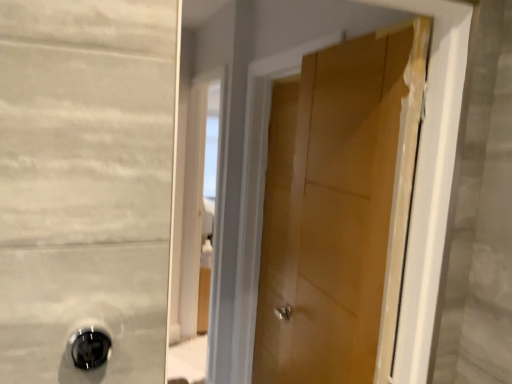
Question: Considering the relative sizes of wooden door at center and black glossy door handle at lower left in the image provided, is wooden door at center shorter than black glossy door handle at lower left?

Choices:
 (A) yes
 (B) no

Answer: (B)

Question: Is wooden door at center bigger than black glossy door handle at lower left?

Choices:
 (A) no
 (B) yes

Answer: (B)

Question: Is wooden door at center positioned behind black glossy door handle at lower left?

Choices:
 (A) no
 (B) yes

Answer: (B)

Question: Is wooden door at center thinner than black glossy door handle at lower left?

Choices:
 (A) yes
 (B) no

Answer: (B)

Question: Can you confirm if wooden door at center is positioned to the right of black glossy door handle at lower left?

Choices:
 (A) no
 (B) yes

Answer: (B)

Question: Does wooden door at center appear on the left side of black glossy door handle at lower left?

Choices:
 (A) no
 (B) yes

Answer: (A)

Question: Considering the relative sizes of black glossy door handle at lower left and wooden door at center in the image provided, is black glossy door handle at lower left shorter than wooden door at center?

Choices:
 (A) yes
 (B) no

Answer: (A)

Question: Can you confirm if black glossy door handle at lower left is positioned to the right of wooden door at center?

Choices:
 (A) no
 (B) yes

Answer: (A)

Question: Is black glossy door handle at lower left closer to the viewer compared to wooden door at center?

Choices:
 (A) no
 (B) yes

Answer: (B)

Question: Is black glossy door handle at lower left at the left side of wooden door at center?

Choices:
 (A) no
 (B) yes

Answer: (B)

Question: Is black glossy door handle at lower left oriented towards wooden door at center?

Choices:
 (A) no
 (B) yes

Answer: (A)

Question: From the image's perspective, does black glossy door handle at lower left appear lower than wooden door at center?

Choices:
 (A) yes
 (B) no

Answer: (A)

Question: In terms of width, does black glossy door handle at lower left look wider or thinner when compared to wooden door at center?

Choices:
 (A) thin
 (B) wide

Answer: (A)